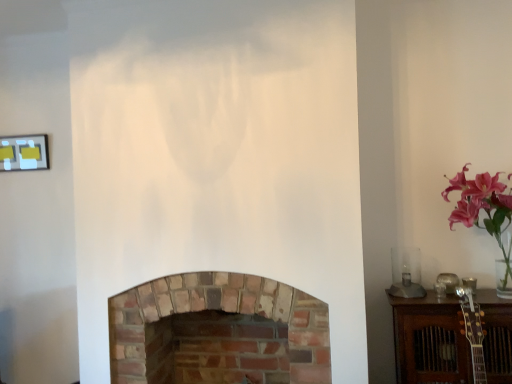
Image resolution: width=512 pixels, height=384 pixels. What do you see at coordinates (218, 331) in the screenshot?
I see `brick fireplace at center` at bounding box center [218, 331].

You are a GUI agent. You are given a task and a screenshot of the screen. Output one action in this format:
    pyautogui.click(x=<x>, y=<y>)
    Task: Click on the brick fireplace at center
    Image resolution: width=512 pixels, height=384 pixels.
    Given the screenshot: What is the action you would take?
    pyautogui.click(x=218, y=331)

Where is `brick fireplace at center`? Image resolution: width=512 pixels, height=384 pixels. brick fireplace at center is located at coordinates (218, 331).